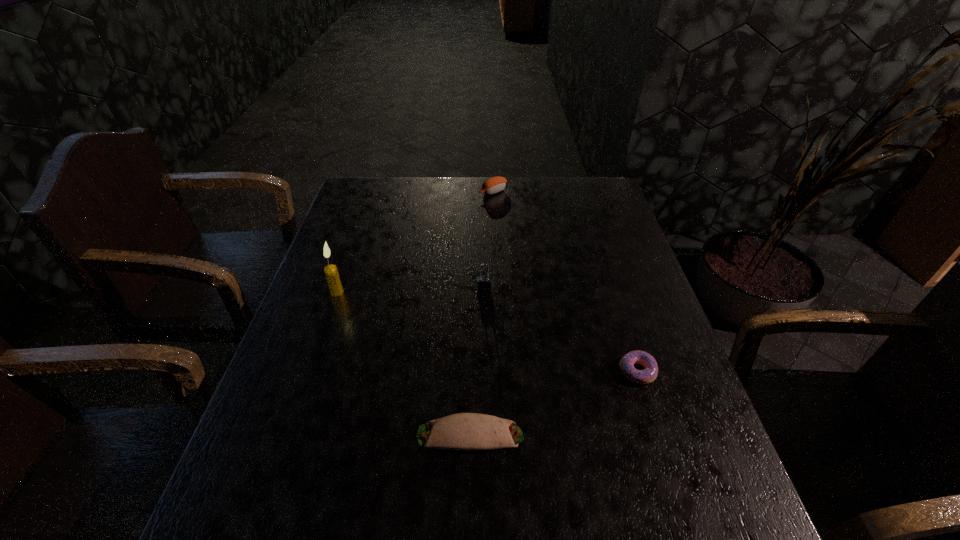
This screenshot has width=960, height=540. Find the location of `candle`. candle is located at coordinates (332, 276).

Find the location of a particular element. The image size is (960, 540). the tallest object is located at coordinates (332, 276).

This screenshot has height=540, width=960. What are the coordinates of `padlock` in the screenshot? It's located at (483, 282).

Locate an element on the screen. Image resolution: width=960 pixels, height=540 pixels. sushi is located at coordinates (493, 185).

I want to click on the farthest object, so click(493, 185).

The height and width of the screenshot is (540, 960). What are the coordinates of `the rightmost object` in the screenshot? It's located at (649, 374).

This screenshot has height=540, width=960. I want to click on the second nearest object, so click(649, 374).

Locate an element on the screen. burrito is located at coordinates (463, 431).

In order to click on free space located 0.280m on the front of the leftmost object in this screenshot , I will do `click(304, 386)`.

In order to click on vacant space situated on the shackle of the fourth shortest object in this screenshot , I will do `click(485, 407)`.